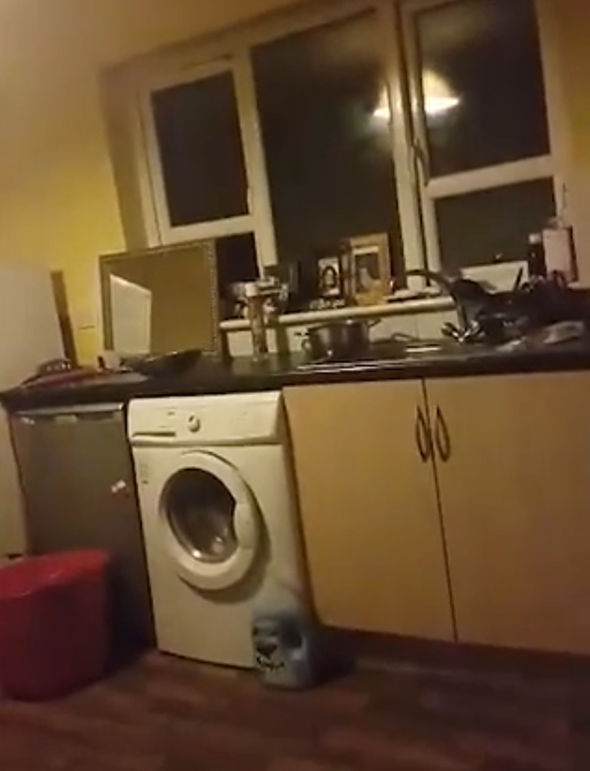
Identify the location of knobs. (116, 490), (195, 423).